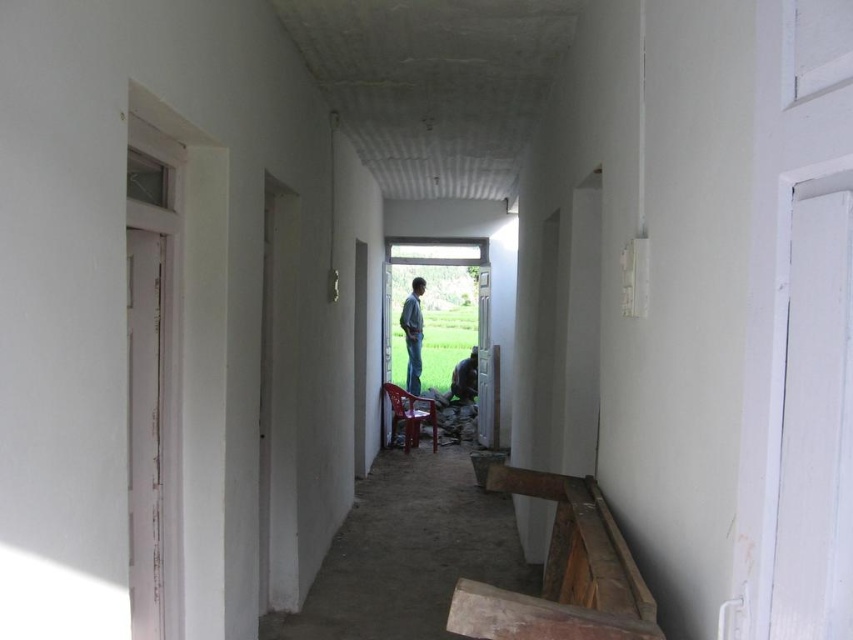
Is plastic chair at center further to the viewer compared to blue denim jeans at center?

No, plastic chair at center is in front of blue denim jeans at center.

Does point (428, 412) lie in front of point (408, 378)?

Yes, it is.

Locate an element on the screen. This screenshot has width=853, height=640. plastic chair at center is located at coordinates (410, 416).

Image resolution: width=853 pixels, height=640 pixels. I want to click on plastic chair at center, so click(x=410, y=416).

Can you confirm if plastic chair at center is positioned to the right of dark brown leather jacket at center?

In fact, plastic chair at center is to the left of dark brown leather jacket at center.

I want to click on plastic chair at center, so click(x=410, y=416).

What do you see at coordinates (413, 333) in the screenshot? I see `blue denim jeans at center` at bounding box center [413, 333].

Based on the photo, can you confirm if blue denim jeans at center is shorter than dark brown leather jacket at center?

No.

Find the location of a particular element. The height and width of the screenshot is (640, 853). blue denim jeans at center is located at coordinates (413, 333).